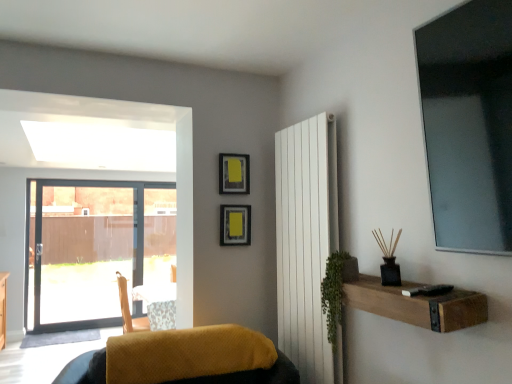
Question: Is brown wooden shelf at lower right aimed at velvet yellow cushion at lower center?

Choices:
 (A) no
 (B) yes

Answer: (A)

Question: From the image's perspective, is brown wooden shelf at lower right below velvet yellow cushion at lower center?

Choices:
 (A) yes
 (B) no

Answer: (B)

Question: Can velvet yellow cushion at lower center be found inside brown wooden shelf at lower right?

Choices:
 (A) no
 (B) yes

Answer: (A)

Question: Does brown wooden shelf at lower right have a greater width compared to velvet yellow cushion at lower center?

Choices:
 (A) no
 (B) yes

Answer: (A)

Question: From a real-world perspective, is brown wooden shelf at lower right physically below velvet yellow cushion at lower center?

Choices:
 (A) yes
 (B) no

Answer: (B)

Question: Is brown wooden shelf at lower right at the left side of velvet yellow cushion at lower center?

Choices:
 (A) no
 (B) yes

Answer: (A)

Question: Is white smooth radiator at center-right thinner than brown wooden shelf at lower right?

Choices:
 (A) no
 (B) yes

Answer: (B)

Question: Would you consider white smooth radiator at center-right to be distant from brown wooden shelf at lower right?

Choices:
 (A) no
 (B) yes

Answer: (A)

Question: Is white smooth radiator at center-right to the left of brown wooden shelf at lower right from the viewer's perspective?

Choices:
 (A) yes
 (B) no

Answer: (A)

Question: Is white smooth radiator at center-right to the right of brown wooden shelf at lower right from the viewer's perspective?

Choices:
 (A) yes
 (B) no

Answer: (B)

Question: Is white smooth radiator at center-right outside of brown wooden shelf at lower right?

Choices:
 (A) yes
 (B) no

Answer: (A)

Question: Does white smooth radiator at center-right have a lesser height compared to brown wooden shelf at lower right?

Choices:
 (A) yes
 (B) no

Answer: (B)

Question: Considering the relative positions of white smooth radiator at center-right and velvet yellow cushion at lower center in the image provided, is white smooth radiator at center-right to the right of velvet yellow cushion at lower center from the viewer's perspective?

Choices:
 (A) no
 (B) yes

Answer: (B)